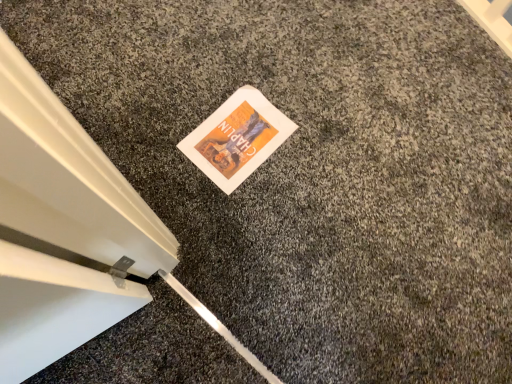
Where is `vacant space underneath white paper at center (from a real-world perspective)`? The height and width of the screenshot is (384, 512). vacant space underneath white paper at center (from a real-world perspective) is located at coordinates (234, 134).